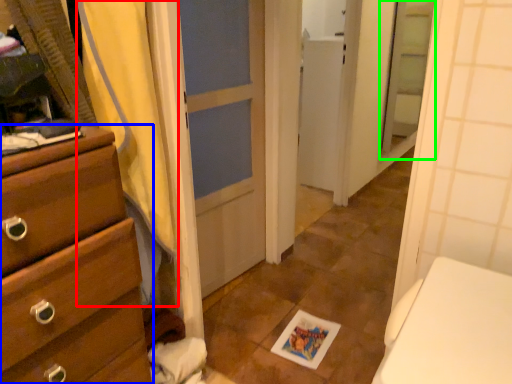
Question: Based on their relative distances, which object is nearer to shower curtain (highlighted by a red box)? Choose from chest of drawers (highlighted by a blue box) and screen door (highlighted by a green box).

Choices:
 (A) chest of drawers
 (B) screen door

Answer: (A)